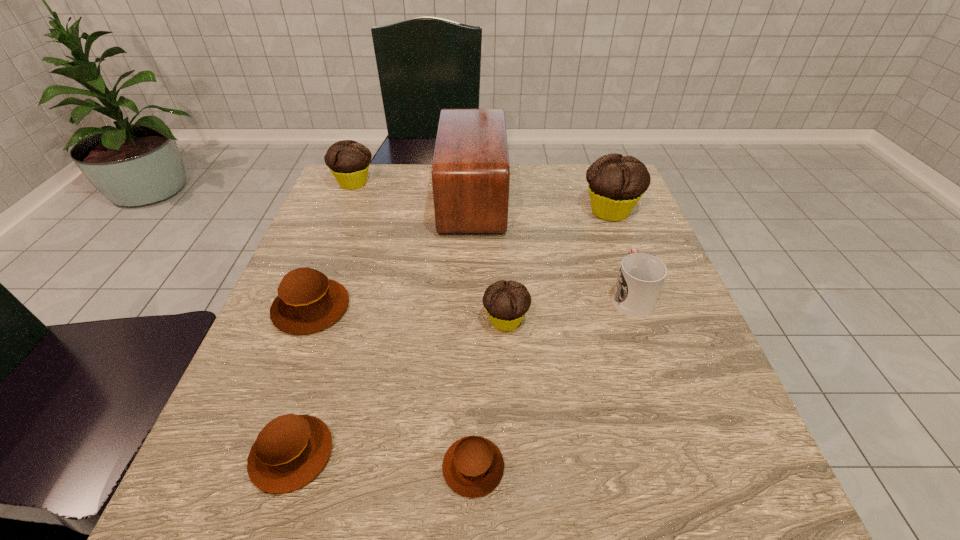
Find the location of a particular element. The width and height of the screenshot is (960, 540). free space at the near edge of the desktop is located at coordinates (488, 524).

This screenshot has height=540, width=960. In the image, there is a desktop. Identify the location of free space at the left edge. (341, 235).

The image size is (960, 540). Identify the location of vacant space at the right edge of the desktop. (742, 457).

Find the location of `vacant region at the far left corner of the desktop`. vacant region at the far left corner of the desktop is located at coordinates (357, 200).

In the image, there is a desktop. Identify the location of vacant space at the near left corner. Image resolution: width=960 pixels, height=540 pixels. [203, 483].

In the image, there is a desktop. What are the coordinates of `free region at the far right corner` in the screenshot? It's located at (589, 204).

Locate an element on the screen. The height and width of the screenshot is (540, 960). vacant space that's between the red cup and the rightmost brown muffin is located at coordinates (552, 381).

Image resolution: width=960 pixels, height=540 pixels. Identify the location of free point between the rightmost muffin and the second shortest muffin. pyautogui.click(x=451, y=333).

Locate an element on the screen. vacant point located between the seventh shortest object and the seventh tallest object is located at coordinates (451, 333).

Locate an element on the screen. This screenshot has width=960, height=540. free point between the rightmost brown muffin and the fifth nearest muffin is located at coordinates (541, 339).